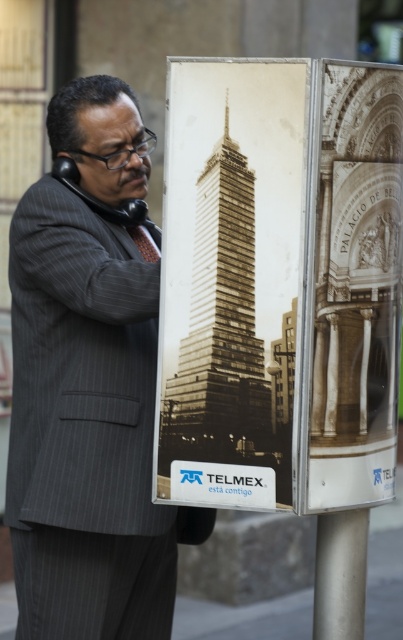
Question: Estimate the real-world distances between objects in this image. Which object is farther from the gray pinstripe suit at center?

Choices:
 (A) satin silver pole at lower center
 (B) sepia-toned photograph of building at center

Answer: (A)

Question: Which point is closer to the camera taking this photo?

Choices:
 (A) (49, 250)
 (B) (207, 275)
 (C) (336, 609)

Answer: (B)

Question: Which object is the closest to the sepia-toned photograph of building at center?

Choices:
 (A) satin silver pole at lower center
 (B) gray pinstripe suit at center

Answer: (B)

Question: Is sepia-toned photograph of building at center further to camera compared to satin silver pole at lower center?

Choices:
 (A) no
 (B) yes

Answer: (A)

Question: Is gray pinstripe suit at center bigger than sepia-toned photograph of building at center?

Choices:
 (A) yes
 (B) no

Answer: (A)

Question: Does gray pinstripe suit at center come behind satin silver pole at lower center?

Choices:
 (A) yes
 (B) no

Answer: (A)